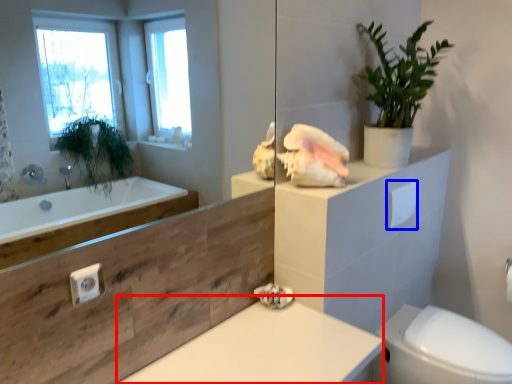
Question: Which object is further to the camera taking this photo, counter top (highlighted by a red box) or toilet paper (highlighted by a blue box)?

Choices:
 (A) counter top
 (B) toilet paper

Answer: (B)